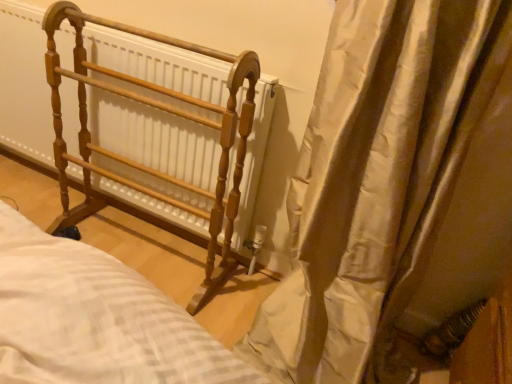
At what (x,y) coordinates should I click in order to perform the action: click on silky beige curtain at right. Please return your answer as a coordinate pair (x, y). This screenshot has height=384, width=512. Looking at the image, I should click on (394, 189).

What is the approximate width of silky beige curtain at right?

It is 18.36 inches.

What do you see at coordinates (394, 189) in the screenshot? I see `silky beige curtain at right` at bounding box center [394, 189].

What do you see at coordinates (160, 110) in the screenshot? This screenshot has height=384, width=512. I see `wooden rack at left` at bounding box center [160, 110].

Identify the location of wooden rack at left. (160, 110).

This screenshot has height=384, width=512. I want to click on silky beige curtain at right, so click(394, 189).

Considering the positions of objects silky beige curtain at right and wooden rack at left in the image provided, who is more to the right, silky beige curtain at right or wooden rack at left?

Positioned to the right is silky beige curtain at right.

Consider the image. Relative to wooden rack at left, is silky beige curtain at right in front or behind?

Clearly, silky beige curtain at right is in front of wooden rack at left.

Is point (448, 302) positioned behind point (250, 112)?

Yes.

From the image's perspective, does silky beige curtain at right appear higher than wooden rack at left?

No, from the image's perspective, silky beige curtain at right is not over wooden rack at left.

From a real-world perspective, which object stands above the other?

In real-world perspective, silky beige curtain at right is above.

Which of these two, silky beige curtain at right or wooden rack at left, is wider?

Wider between the two is silky beige curtain at right.

Between silky beige curtain at right and wooden rack at left, which one has less height?

With less height is wooden rack at left.

Considering the sizes of objects silky beige curtain at right and wooden rack at left in the image provided, who is bigger, silky beige curtain at right or wooden rack at left?

Bigger between the two is silky beige curtain at right.

Would you say wooden rack at left is part of silky beige curtain at right's contents?

No, silky beige curtain at right does not contain wooden rack at left.

Would you say silky beige curtain at right is a long distance from wooden rack at left?

Actually, silky beige curtain at right and wooden rack at left are a little close together.

Is silky beige curtain at right oriented towards wooden rack at left?

No, silky beige curtain at right is not oriented towards wooden rack at left.

How different are the orientations of silky beige curtain at right and wooden rack at left in degrees?

silky beige curtain at right and wooden rack at left are facing 1.27 degrees away from each other.

This screenshot has width=512, height=384. I want to click on furniture behind the silky beige curtain at right, so click(x=160, y=110).

Is wooden rack at left to the left or to the right of silky beige curtain at right in the image?

In the image, wooden rack at left appears on the left side of silky beige curtain at right.

Which object is further away from the camera taking this photo, wooden rack at left or silky beige curtain at right?

wooden rack at left is more distant.

Considering the positions of point (67, 182) and point (324, 295), is point (67, 182) closer or farther from the camera than point (324, 295)?

Clearly, point (67, 182) is more distant from the camera than point (324, 295).

From the picture: From the image's perspective, which is above, wooden rack at left or silky beige curtain at right?

wooden rack at left, from the image's perspective.

From a real-world perspective, is wooden rack at left over silky beige curtain at right?

No.

Does wooden rack at left have a greater width compared to silky beige curtain at right?

No.

Does wooden rack at left have a greater height compared to silky beige curtain at right?

Incorrect, the height of wooden rack at left is not larger of that of silky beige curtain at right.

Between wooden rack at left and silky beige curtain at right, which one has smaller size?

wooden rack at left is smaller.

Would you say wooden rack at left is inside or outside silky beige curtain at right?

wooden rack at left is not enclosed by silky beige curtain at right.

Is wooden rack at left next to silky beige curtain at right?

There is a gap between wooden rack at left and silky beige curtain at right.

Does wooden rack at left turn towards silky beige curtain at right?

No, wooden rack at left is not facing towards silky beige curtain at right.

How many degrees apart are the facing directions of wooden rack at left and silky beige curtain at right?

They differ by 1.27 degrees in their facing directions.

This screenshot has height=384, width=512. Identify the location of furniture on the left side of silky beige curtain at right. (160, 110).

At what (x,y) coordinates should I click in order to perform the action: click on furniture behind the silky beige curtain at right. Please return your answer as a coordinate pair (x, y). The width and height of the screenshot is (512, 384). Looking at the image, I should click on (160, 110).

Find the location of a particular element. curtain that appears above the wooden rack at left (from a real-world perspective) is located at coordinates (394, 189).